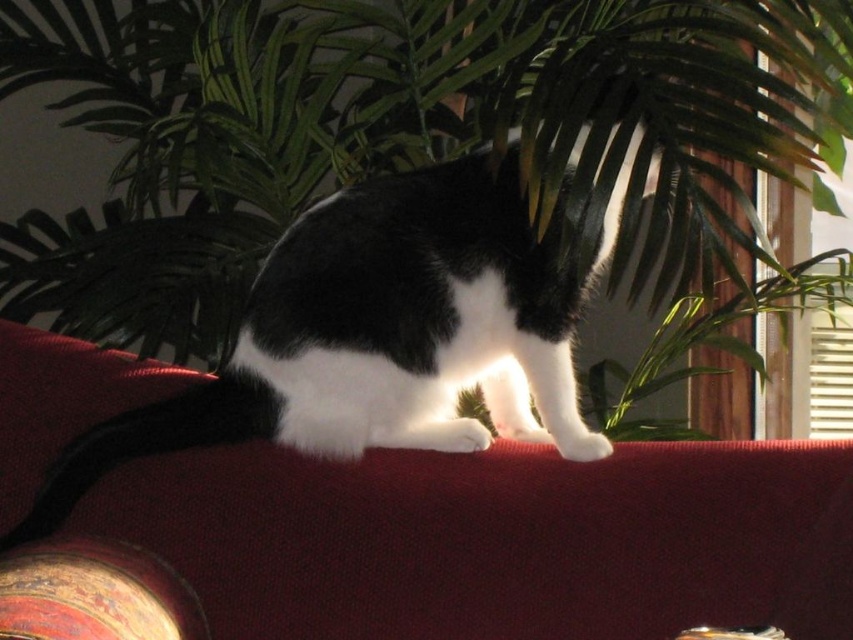
Question: Can you confirm if green leafy plant at upper center is positioned to the left of burgundy fabric couch at upper center?

Choices:
 (A) no
 (B) yes

Answer: (B)

Question: Among these points, which one is farthest from the camera?

Choices:
 (A) (480, 428)
 (B) (186, 460)
 (C) (561, 61)

Answer: (C)

Question: Which object is positioned closest to the burgundy fabric couch at upper center?

Choices:
 (A) black/white fur cat at center
 (B) green leafy plant at upper center

Answer: (A)

Question: Is green leafy plant at upper center closer to camera compared to burgundy fabric couch at upper center?

Choices:
 (A) yes
 (B) no

Answer: (B)

Question: Estimate the real-world distances between objects in this image. Which object is farther from the black/white fur cat at center?

Choices:
 (A) burgundy fabric couch at upper center
 (B) green leafy plant at upper center

Answer: (B)

Question: Where is green leafy plant at upper center located in relation to burgundy fabric couch at upper center in the image?

Choices:
 (A) below
 (B) above

Answer: (B)